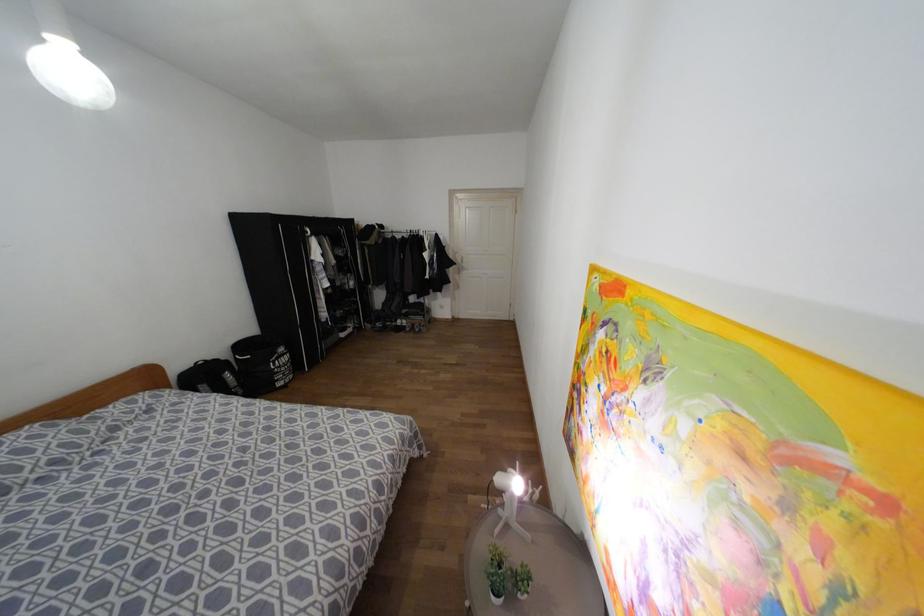
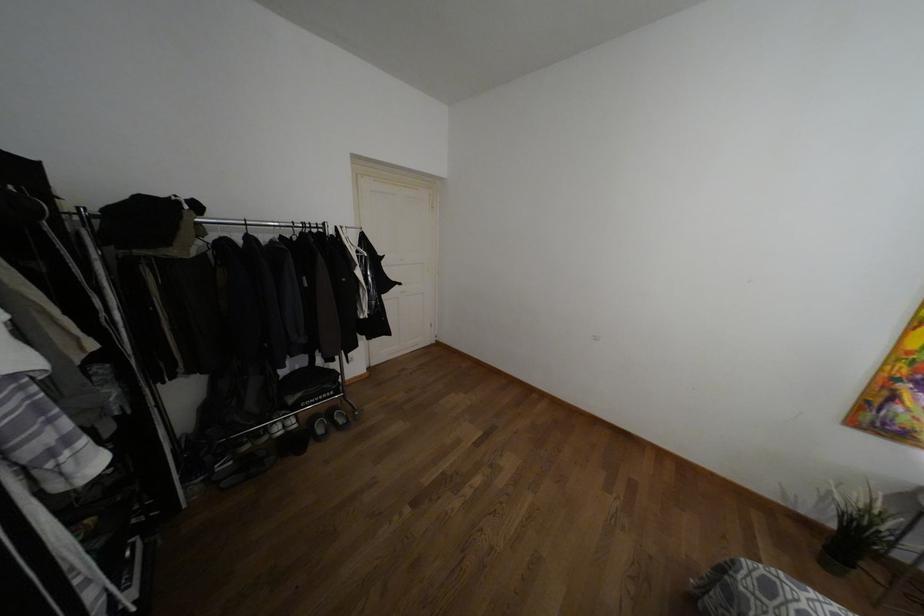
The point at (397, 321) is marked in the first image. Where is the corresponding point in the second image?

(275, 427)